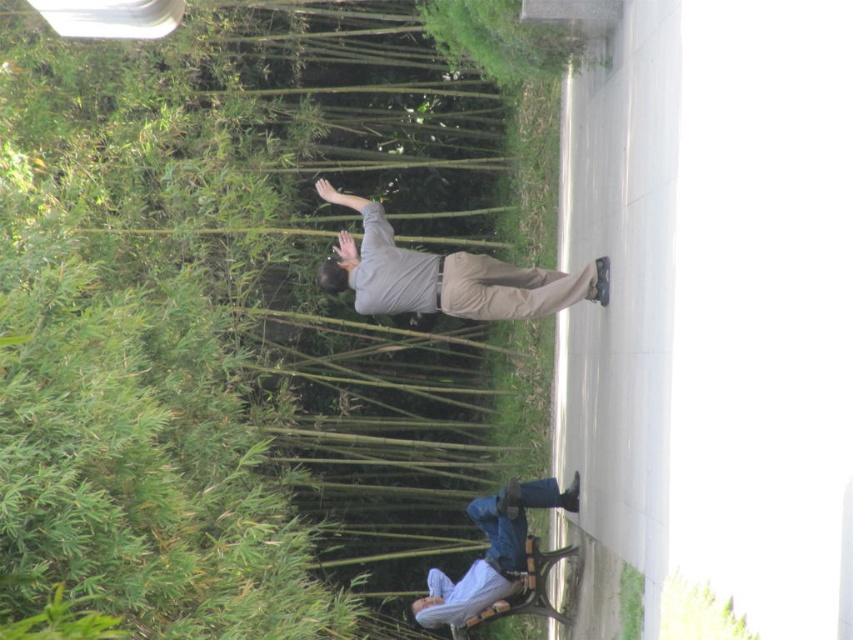
You are standing at point (527, 566) and want to walk towards point (244, 248). Is there any obstruction between you and your destination?

Point (244, 248) is behind point (527, 566), so there is no obstruction between them. You can walk directly towards the destination.

You are a photographer setting up a shot in the park. You want to capture both the green bamboo at upper left and the blue denim jeans at lower right in your frame. Which object should you focus on first to ensure they are both in focus?

The green bamboo at upper left is taller than the blue denim jeans at lower right, so you should focus on the green bamboo at upper left first to ensure both are in focus.